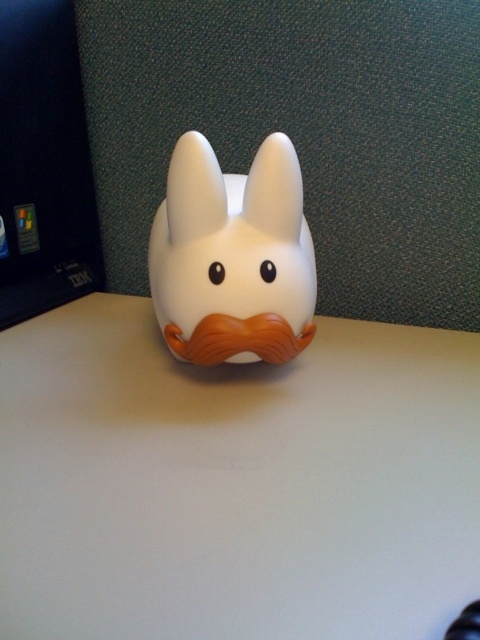
Question: Does white matte table at center have a larger size compared to black plastic laptop at left?

Choices:
 (A) yes
 (B) no

Answer: (A)

Question: Does white matte rabbit at center appear on the right side of black plastic laptop at left?

Choices:
 (A) no
 (B) yes

Answer: (B)

Question: Which of the following is the farthest from the observer?

Choices:
 (A) (75, 129)
 (B) (67, 458)

Answer: (A)

Question: Based on their relative distances, which object is farther from the black plastic laptop at left?

Choices:
 (A) white matte table at center
 (B) white matte rabbit at center

Answer: (A)

Question: Which object is positioned farthest from the black plastic laptop at left?

Choices:
 (A) white matte rabbit at center
 (B) white matte table at center

Answer: (B)

Question: Does white matte rabbit at center have a greater width compared to black plastic laptop at left?

Choices:
 (A) yes
 (B) no

Answer: (A)